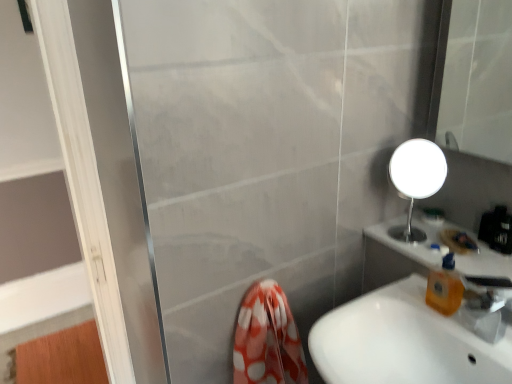
Question: Could white glossy sink at lower right be considered to be inside transparent plastic tap at lower right?

Choices:
 (A) yes
 (B) no

Answer: (B)

Question: Is transparent plastic tap at lower right thinner than white glossy sink at lower right?

Choices:
 (A) no
 (B) yes

Answer: (B)

Question: Is transparent plastic tap at lower right wider than white glossy sink at lower right?

Choices:
 (A) no
 (B) yes

Answer: (A)

Question: Is transparent plastic tap at lower right at the left side of white glossy sink at lower right?

Choices:
 (A) no
 (B) yes

Answer: (A)

Question: From a real-world perspective, is transparent plastic tap at lower right positioned under white glossy sink at lower right based on gravity?

Choices:
 (A) yes
 (B) no

Answer: (B)

Question: From the image's perspective, is white glossy sink at lower right above or below orange translucent soap dispenser at right?

Choices:
 (A) above
 (B) below

Answer: (B)

Question: Relative to orange translucent soap dispenser at right, is white glossy sink at lower right in front or behind?

Choices:
 (A) behind
 (B) front

Answer: (B)

Question: Would you say white glossy sink at lower right is inside or outside orange translucent soap dispenser at right?

Choices:
 (A) inside
 (B) outside

Answer: (B)

Question: Is point (349, 379) positioned closer to the camera than point (449, 294)?

Choices:
 (A) closer
 (B) farther

Answer: (A)

Question: In terms of height, does orange translucent soap dispenser at right look taller or shorter compared to transparent plastic tap at lower right?

Choices:
 (A) tall
 (B) short

Answer: (A)

Question: From a real-world perspective, is orange translucent soap dispenser at right above or below transparent plastic tap at lower right?

Choices:
 (A) above
 (B) below

Answer: (A)

Question: In terms of width, does orange translucent soap dispenser at right look wider or thinner when compared to transparent plastic tap at lower right?

Choices:
 (A) thin
 (B) wide

Answer: (A)

Question: From the image's perspective, is orange translucent soap dispenser at right located above or below transparent plastic tap at lower right?

Choices:
 (A) above
 (B) below

Answer: (A)

Question: Is transparent plastic tap at lower right bigger or smaller than white glossy sink at lower right?

Choices:
 (A) small
 (B) big

Answer: (A)

Question: Visually, is transparent plastic tap at lower right positioned to the left or to the right of white glossy sink at lower right?

Choices:
 (A) right
 (B) left

Answer: (A)